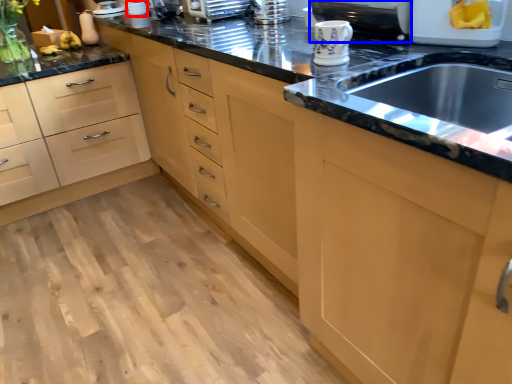
Question: Which object is further to the camera taking this photo, appliance (highlighted by a red box) or appliance (highlighted by a blue box)?

Choices:
 (A) appliance
 (B) appliance

Answer: (A)